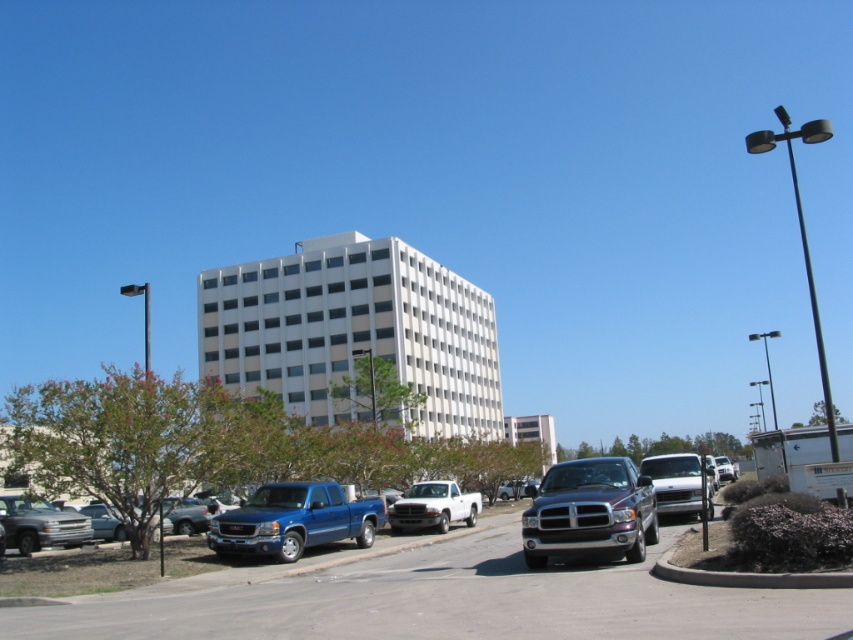
You are a delivery driver who needs to park your vehicle in the parking lot shown in the image. You have a truck that is 2 meters wide. The parking space you want to use is designed for vehicles up to 2.5 meters wide. Can you safely park your metallic blue truck at center in this space without damaging the white matte trailer at lower right?

The metallic blue truck at center is narrower than the white matte trailer at lower right. Since your truck is 2 meters wide and the parking space allows up to 2.5 meters, you can safely park there without damaging the trailer.